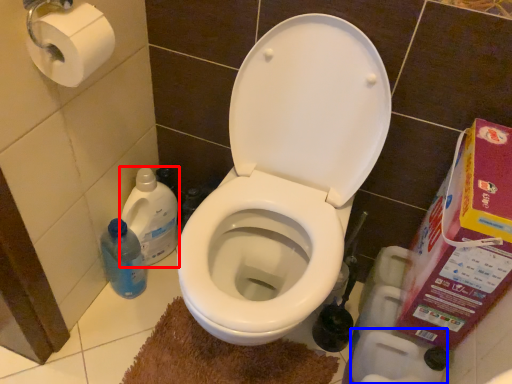
Question: Which object appears farthest to the camera in this image, cleaning product (highlighted by a red box) or toilet paper (highlighted by a blue box)?

Choices:
 (A) cleaning product
 (B) toilet paper

Answer: (A)